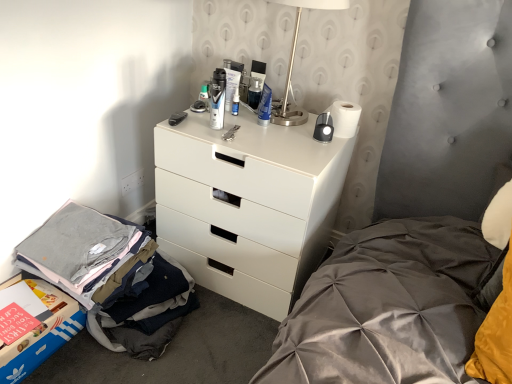
Question: In terms of width, does matte plastic tube at upper center, marked as the 3th toiletry in a right-to-left arrangement, look wider or thinner when compared to white matte chest of drawers at center?

Choices:
 (A) thin
 (B) wide

Answer: (A)

Question: Considering the positions of point (229, 66) and point (214, 152), is point (229, 66) closer or farther from the camera than point (214, 152)?

Choices:
 (A) closer
 (B) farther

Answer: (B)

Question: Estimate the real-world distances between objects in this image. Which object is farther from the translucent plastic bottle at upper center, the 1th toiletry from the left?

Choices:
 (A) matte plastic tube at upper center, marked as the 3th toiletry in a right-to-left arrangement
 (B) satin silver table lamp at upper right
 (C) white matte chest of drawers at center
 (D) white plastic outlet at lower left
 (E) gray cotton t-shirts at lower left

Answer: (E)

Question: Which of these objects is positioned farthest from the white matte chest of drawers at center?

Choices:
 (A) translucent plastic bottle at upper center, the 1th toiletry from the left
 (B) blue glossy bottle at center, the second toiletry viewed from the right
 (C) white plastic outlet at lower left
 (D) matte black shaving cream can at center, acting as the 4th toiletry starting from the right
 (E) satin silver table lamp at upper right

Answer: (C)